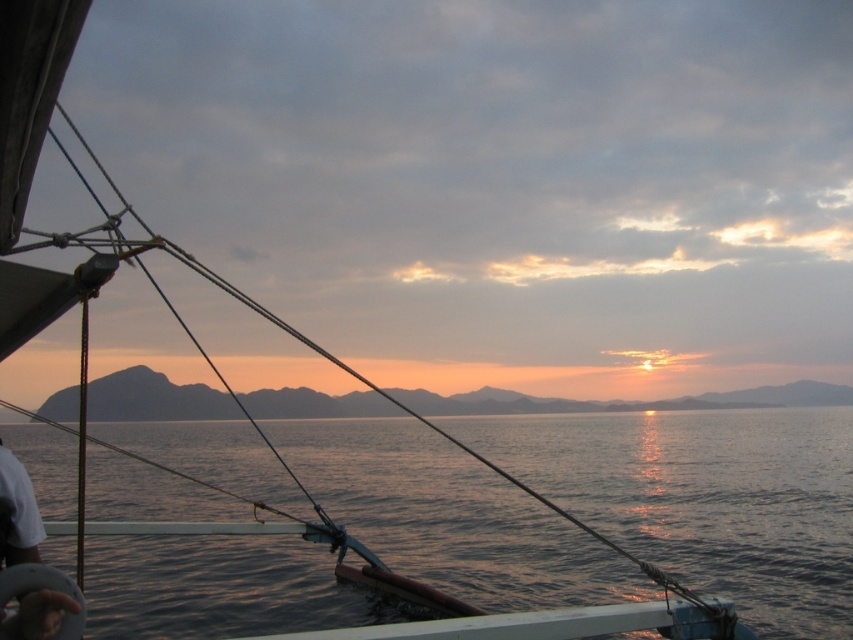
You are navigating a small boat and see the dark blue water at center and the silvery metallic horizon at center. Which object is positioned to the left when facing the scene?

The dark blue water at center is to the left of the silvery metallic horizon at center, so the dark blue water at center is positioned to the left when facing the scene.

You are on a boat watching the sunset. You notice two points in the scene, one at coordinates point (416, 497) and another at point (142, 381). Which point is nearer to you?

Point (416, 497) is closer to the camera than point (142, 381), so the point at coordinates point (416, 497) is nearer to you.

You are an observer on the boat looking at the dark blue water at center and the silvery metallic horizon at center. Which object is positioned higher in the visual field?

The dark blue water at center is positioned higher in the visual field than the silvery metallic horizon at center because it is located above it according to the description.